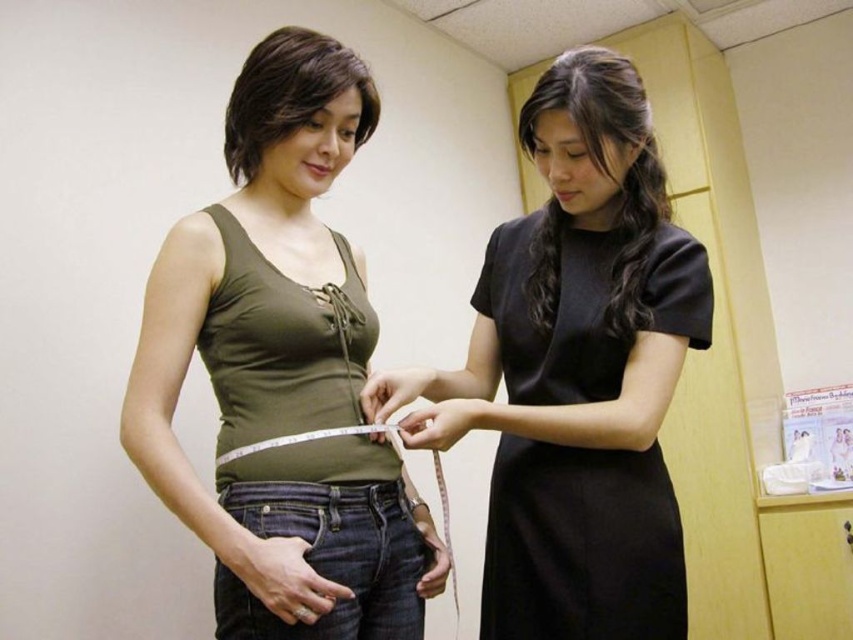
You are a fashion designer observing a clinical setting. You see a matte green tank top at center and a black satin dress at upper right. Which clothing item has a larger size?

The matte green tank top at center is bigger than the black satin dress at upper right.

You are a nurse in a clinic and need to hand a patient a form. The form is on the counter behind you. To reach it, you must walk around either the matte green tank top at center or the black satin dress at center. Which one should you go around to get to the form?

You should go around the black satin dress at center because the matte green tank top at center is to the left of it, meaning the black satin dress at center is closer to the counter where the form is located.